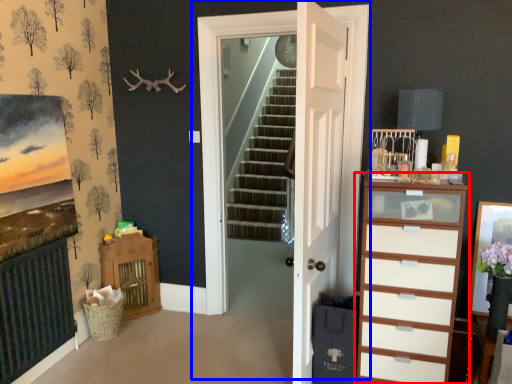
Question: Among these objects, which one is farthest to the camera, chest of drawers (highlighted by a red box) or door (highlighted by a blue box)?

Choices:
 (A) chest of drawers
 (B) door

Answer: (B)